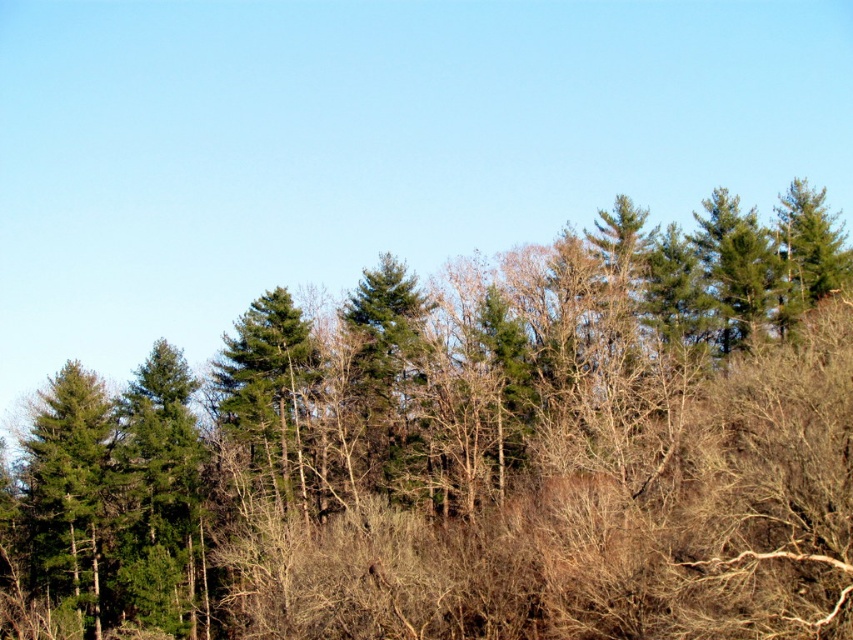
Question: Is green matte trees at center thinner than green matte tree at left?

Choices:
 (A) yes
 (B) no

Answer: (B)

Question: Does green matte trees at center appear on the right side of green matte tree at left?

Choices:
 (A) yes
 (B) no

Answer: (A)

Question: Considering the relative positions of green matte trees at center and green matte tree at left in the image provided, where is green matte trees at center located with respect to green matte tree at left?

Choices:
 (A) right
 (B) left

Answer: (A)

Question: Which point is closer to the camera?

Choices:
 (A) click(61, 442)
 (B) click(767, 417)

Answer: (B)

Question: Which point is farther from the camera taking this photo?

Choices:
 (A) (62, 566)
 (B) (471, 557)

Answer: (A)